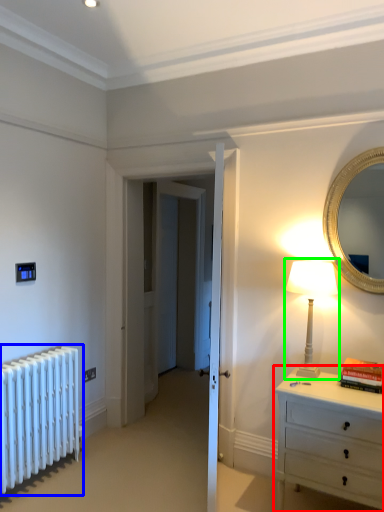
Question: Which is farther away from chest of drawers (highlighted by a red box)? radiator (highlighted by a blue box) or table lamp (highlighted by a green box)?

Choices:
 (A) radiator
 (B) table lamp

Answer: (A)